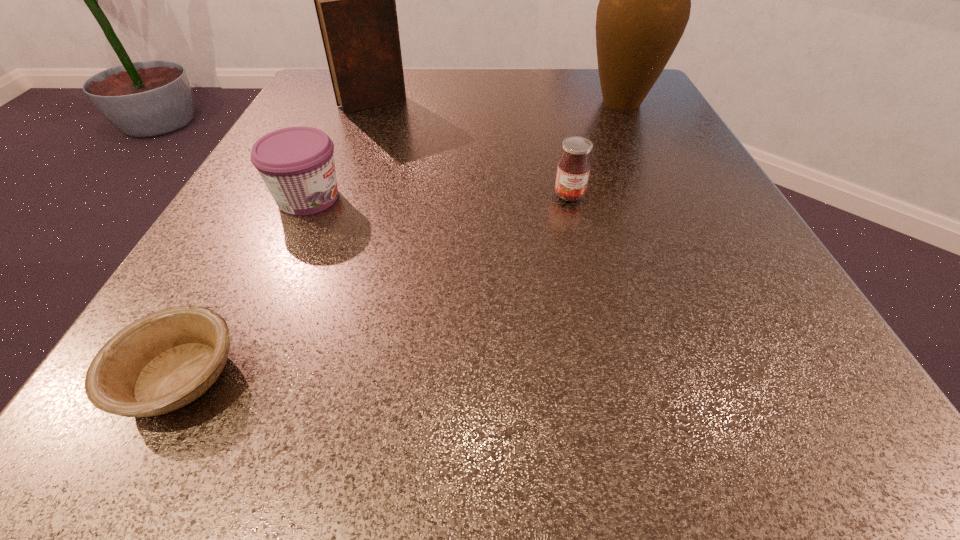
The image size is (960, 540). Find the location of `free location located 0.130m on the label side of the second object from right to left`. free location located 0.130m on the label side of the second object from right to left is located at coordinates (586, 263).

Where is `vacant position located 0.130m on the back of the nearest object`? vacant position located 0.130m on the back of the nearest object is located at coordinates (247, 253).

Locate an element on the screen. urn located at the far edge is located at coordinates (645, 0).

The width and height of the screenshot is (960, 540). I want to click on Bible located at the far edge, so pyautogui.click(x=355, y=0).

Locate an element on the screen. The width and height of the screenshot is (960, 540). object at the near edge is located at coordinates (163, 361).

Where is `Bible present at the left edge`? The image size is (960, 540). Bible present at the left edge is located at coordinates (355, 0).

Locate an element on the screen. This screenshot has height=540, width=960. jam that is at the left edge is located at coordinates [x=297, y=165].

The width and height of the screenshot is (960, 540). In order to click on bowl that is at the left edge in this screenshot , I will do `click(163, 361)`.

Where is `object that is at the right edge`? The height and width of the screenshot is (540, 960). object that is at the right edge is located at coordinates (645, 0).

Where is `object situated at the far left corner`? The width and height of the screenshot is (960, 540). object situated at the far left corner is located at coordinates (355, 0).